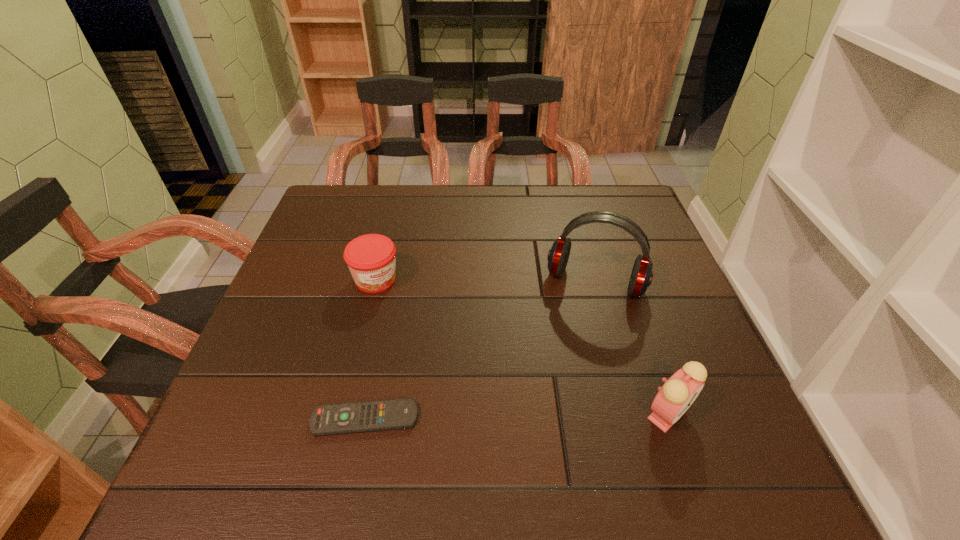
The width and height of the screenshot is (960, 540). I want to click on vacant area between the second tallest object and the tallest object, so click(632, 348).

Find the location of a particular element. object identified as the third closest to the second tallest object is located at coordinates (371, 258).

Locate which object is the closest to the tallest object. Please provide its 2D coordinates. Your answer should be formatted as a tuple, i.e. [(x, y)], where the tuple contains the x and y coordinates of a point satisfying the conditions above.

[(673, 399)]

Identify the location of free point that satisfies the following two spatial constraints: 1. on the back side of the shortest object; 2. on the left side of the earphone. This screenshot has height=540, width=960. (394, 282).